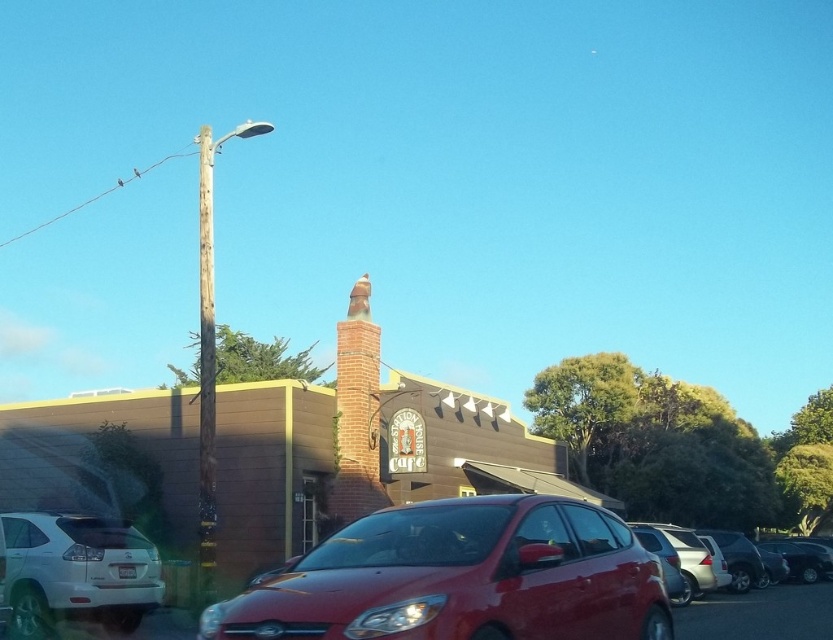
Can you confirm if glossy red sedan at center is positioned below weathered wood pole at left?

Yes, glossy red sedan at center is below weathered wood pole at left.

Who is positioned more to the right, glossy red sedan at center or weathered wood pole at left?

From the viewer's perspective, glossy red sedan at center appears more on the right side.

Who is more forward, (253, 632) or (208, 333)?

Point (253, 632) is more forward.

Image resolution: width=833 pixels, height=640 pixels. I want to click on glossy red sedan at center, so click(x=460, y=577).

Can you confirm if glossy red sedan at center is positioned below white matte suv at lower left?

No, glossy red sedan at center is not below white matte suv at lower left.

Does glossy red sedan at center come behind white matte suv at lower left?

That is False.

Where is `glossy red sedan at center`? Image resolution: width=833 pixels, height=640 pixels. glossy red sedan at center is located at coordinates (460, 577).

The image size is (833, 640). Describe the element at coordinates (73, 572) in the screenshot. I see `white matte suv at lower left` at that location.

Is white matte suv at lower left bigger than weathered wood pole at left?

Incorrect, white matte suv at lower left is not larger than weathered wood pole at left.

Which is in front, point (68, 576) or point (202, 348)?

Point (68, 576)

Where is `white matte suv at lower left`? The image size is (833, 640). white matte suv at lower left is located at coordinates click(x=73, y=572).